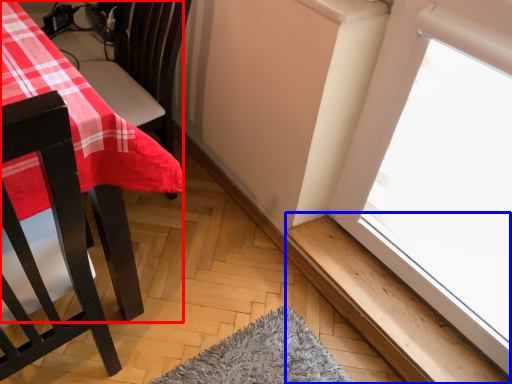
Question: Which point is further to the camera, table (highlighted by a red box) or window sill (highlighted by a blue box)?

Choices:
 (A) table
 (B) window sill

Answer: (B)